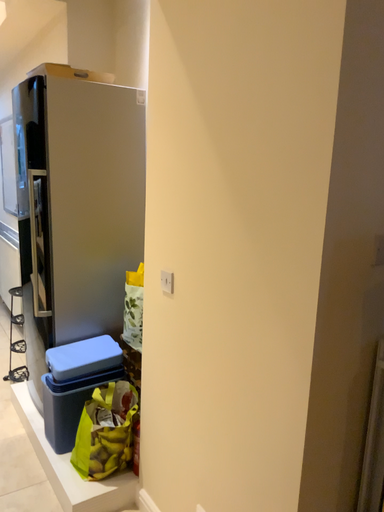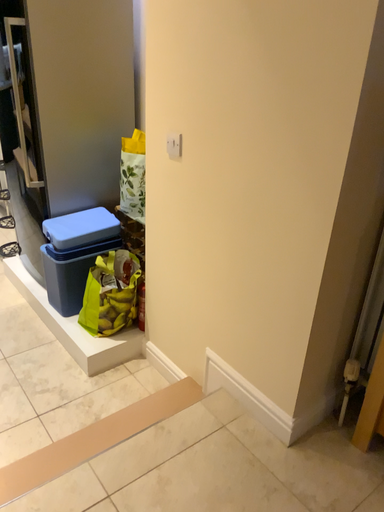
Question: How did the camera likely rotate when shooting the video?

Choices:
 (A) rotated upward
 (B) rotated downward

Answer: (B)